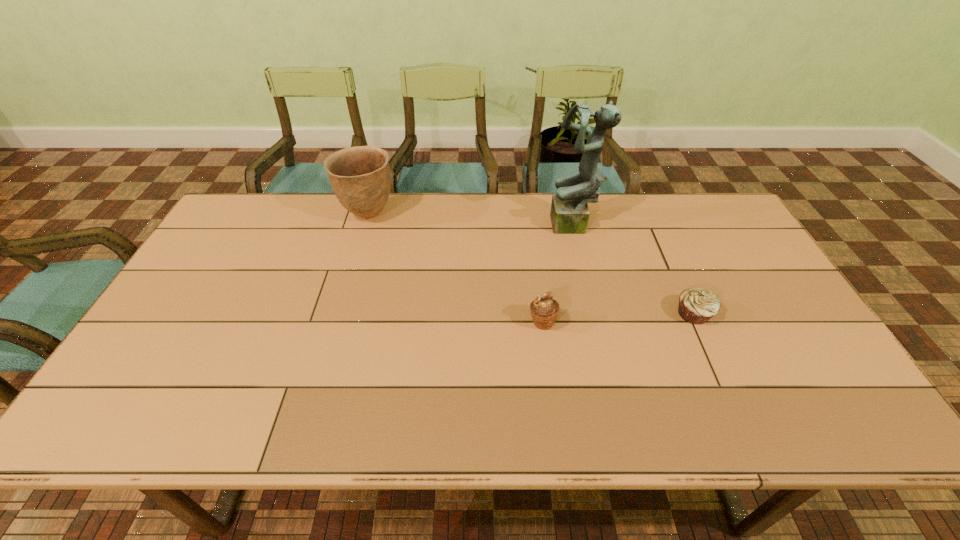
At what (x,y) coordinates should I click in order to perform the action: click on the tallest object. Please return your answer as a coordinate pair (x, y). Image resolution: width=960 pixels, height=540 pixels. Looking at the image, I should click on (569, 214).

Find the location of a particular element. The width and height of the screenshot is (960, 540). the third object from left to right is located at coordinates (569, 214).

The image size is (960, 540). Identify the location of pottery. (360, 177).

Locate an element on the screen. This screenshot has width=960, height=540. the leftmost object is located at coordinates (360, 177).

Where is `the third tallest object`? The image size is (960, 540). the third tallest object is located at coordinates (544, 310).

This screenshot has height=540, width=960. What are the coordinates of `the third object from right to left` in the screenshot? It's located at (544, 310).

I want to click on the shorter muffin, so click(696, 305).

Identify the location of the rightmost object. (696, 305).

Where is `vacant region located 0.230m on the face of the sculpture`? vacant region located 0.230m on the face of the sculpture is located at coordinates (479, 227).

The height and width of the screenshot is (540, 960). I want to click on vacant region located on the face of the sculpture, so click(535, 227).